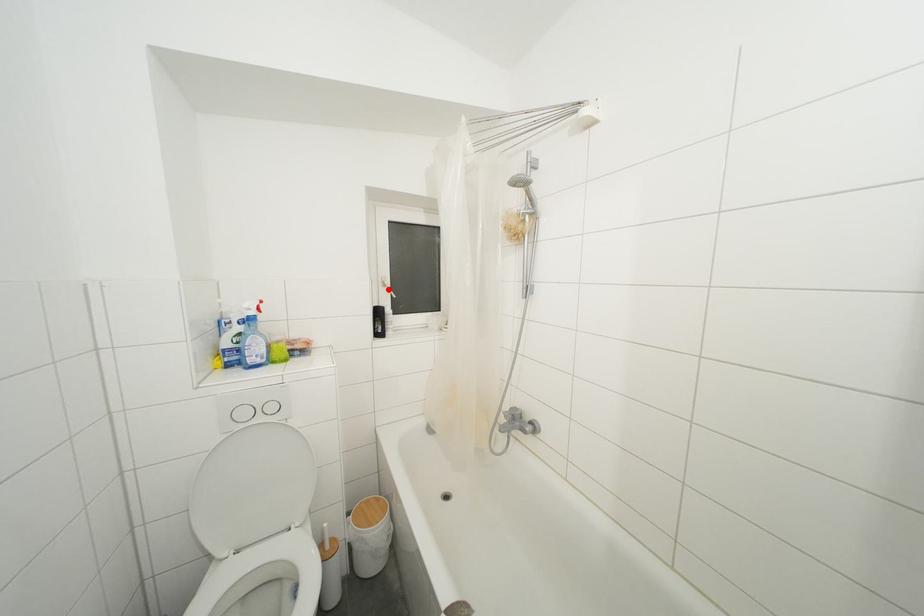
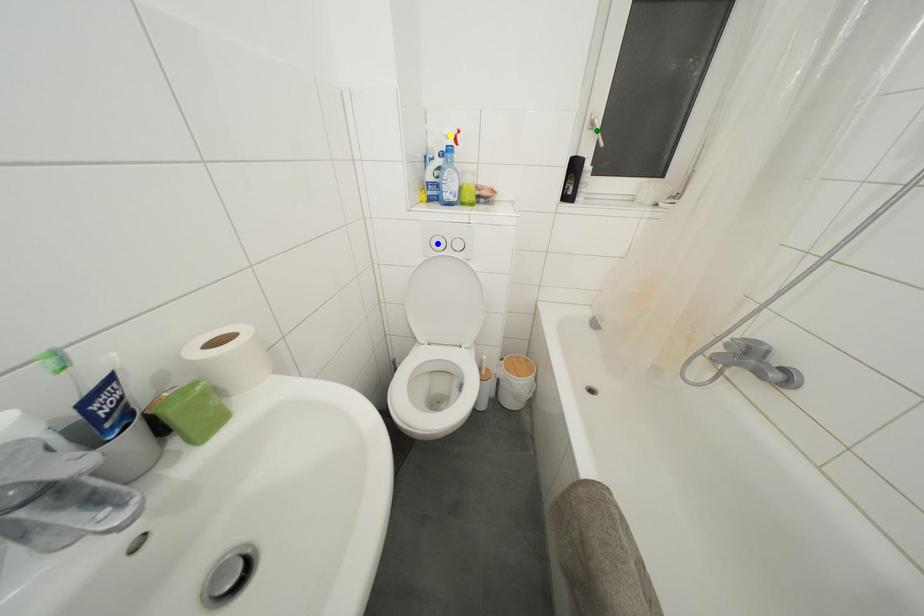
Question: I am providing you with two images of the same scene from different viewpoints. A red point is marked on the first image. You are given multiple points on the second image. Can you choose the point in image 2 that corresponds to the point in image 1?

Choices:
 (A) green point
 (B) yellow point
 (C) blue point

Answer: (A)